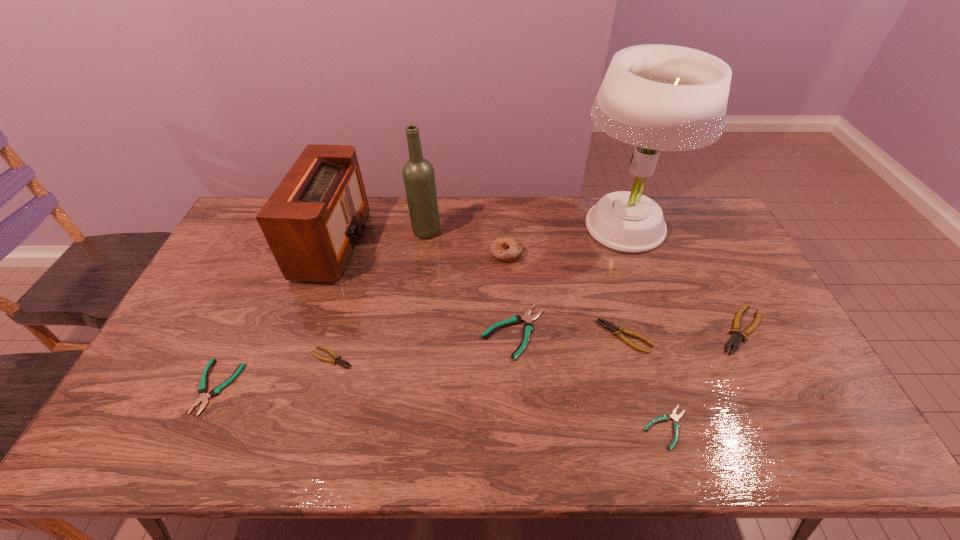
Locate an element on the screen. Image resolution: width=960 pixels, height=540 pixels. free space that is in between the wine bottle and the smallest yellow pliers is located at coordinates (379, 294).

Find the location of a particular element. vacant point located between the tallest object and the seventh shortest object is located at coordinates (564, 241).

I want to click on vacant point located between the third tallest object and the fifth tallest object, so click(x=538, y=287).

This screenshot has height=540, width=960. Identify the location of vacant area that lies between the second teal pliers from left to right and the smallest yellow pliers. (423, 345).

Image resolution: width=960 pixels, height=540 pixels. Find the location of `vacant area that lies between the second yellow pliers from left to right and the green wine bottle`. vacant area that lies between the second yellow pliers from left to right and the green wine bottle is located at coordinates (525, 284).

You are a GUI agent. You are given a task and a screenshot of the screen. Output one action in this format:
    pyautogui.click(x=<x>, y=<y>)
    Task: Click on the free space that is in between the rightmost teal pliers and the radio receiver
    Image resolution: width=960 pixels, height=540 pixels.
    Given the screenshot: What is the action you would take?
    pyautogui.click(x=500, y=335)

Find the location of a particular element. the eighth closest object to the eighth shortest object is located at coordinates (676, 425).

Where is `object that ranks as the closest to the smallest teal pliers`? This screenshot has width=960, height=540. object that ranks as the closest to the smallest teal pliers is located at coordinates tap(605, 324).

Identify which pliers is the second closest to the second smallest yellow pliers. Please provide its 2D coordinates. Your answer should be formatted as a tuple, i.e. [(x, y)], where the tuple contains the x and y coordinates of a point satisfying the conditions above.

[(676, 425)]

Select which pliers is the closest to the second teal pliers from right to left. Please provide its 2D coordinates. Your answer should be formatted as a tuple, i.e. [(x, y)], where the tuple contains the x and y coordinates of a point satisfying the conditions above.

[(605, 324)]